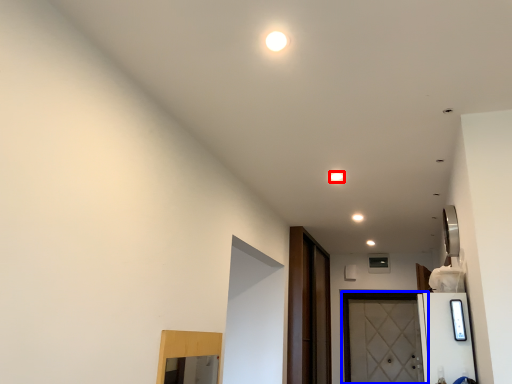
Question: Which object appears farthest to the camera in this image, light (highlighted by a red box) or door (highlighted by a blue box)?

Choices:
 (A) light
 (B) door

Answer: (B)